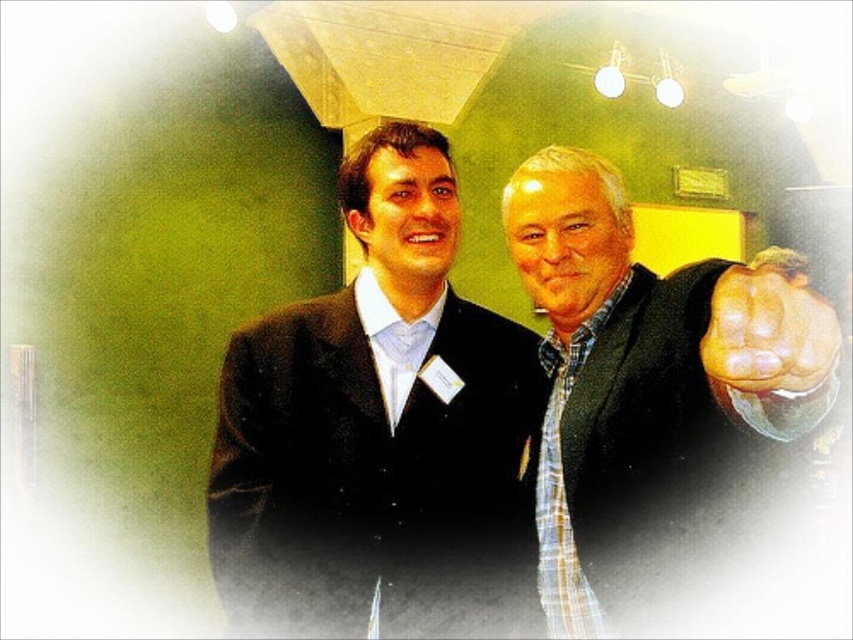
You are a photographer setting up for a group photo and notice the black woolen suit at center and the muscular skin fist at right. Which object should you focus on first if you want to capture the larger object in the scene?

The black woolen suit at center is larger in size than the muscular skin fist at right, so you should focus on the black woolen suit at center first to capture the larger object.

You are a photographer at a formal event. You need to capture a photo where both the black woolen suit at center and the plaid shirt at right are clearly visible. Considering their sizes, which object should you ensure is positioned closer to the camera to avoid being obscured?

Since the black woolen suit at center is wider than the plaid shirt at right, you should position the plaid shirt at right closer to the camera to ensure it remains visible and not obscured by the wider black woolen suit at center.

You are at a formal event and see two people in the image. The person on the left is wearing a dark suit jacket over a light blue shirt, and the person on the right is wearing a plaid shirt at right. They are both standing close together. The person on the right has a muscular skin fist at right. Which object is higher up in the image?

The plaid shirt at right is taller than the muscular skin fist at right, so the plaid shirt at right is higher up in the image.